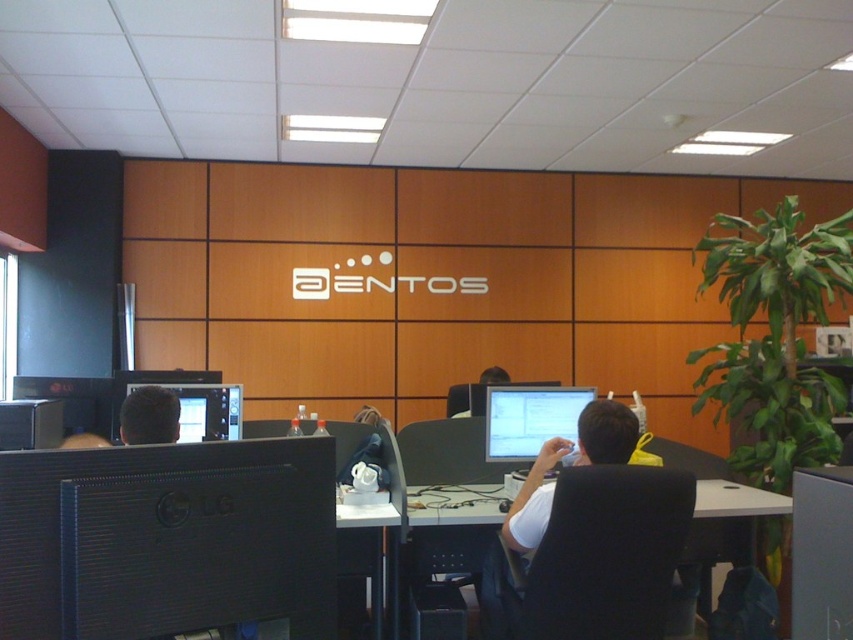
Does white plastic table at center lie behind matte black monitor at left?

That is False.

Is white plastic table at center thinner than matte black monitor at left?

Correct, white plastic table at center's width is less than matte black monitor at left's.

Locate an element on the screen. white plastic table at center is located at coordinates (451, 504).

I want to click on white plastic table at center, so click(451, 504).

Consider the image. Does matte black monitor at center have a smaller size compared to white plastic table at center?

Actually, matte black monitor at center might be larger than white plastic table at center.

Identify the location of matte black monitor at center. pyautogui.click(x=531, y=419).

Is black glossy monitor at lower left below matte black monitor at left?

Correct, black glossy monitor at lower left is located below matte black monitor at left.

Which of these two, black glossy monitor at lower left or matte black monitor at left, stands shorter?

matte black monitor at left is shorter.

This screenshot has height=640, width=853. Identify the location of black glossy monitor at lower left. (166, 538).